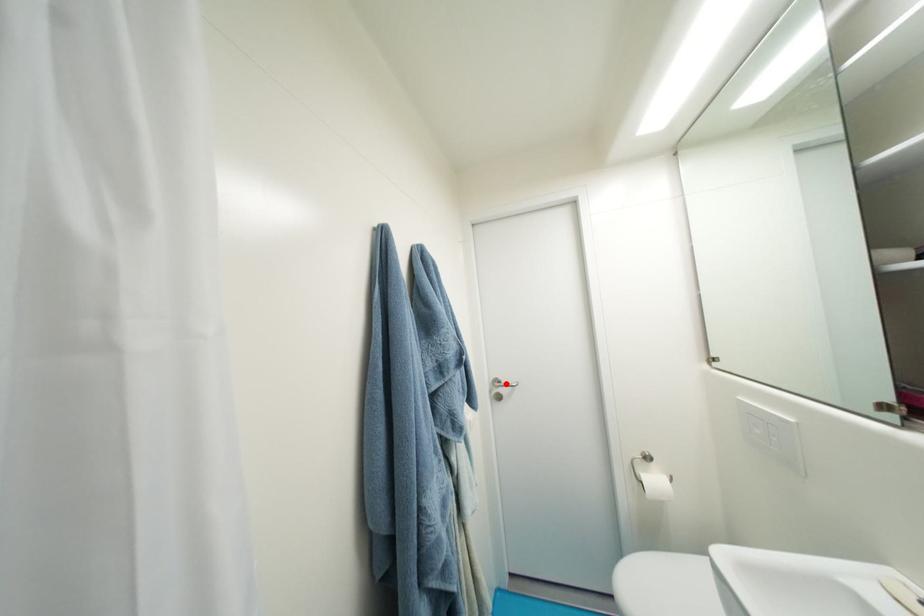
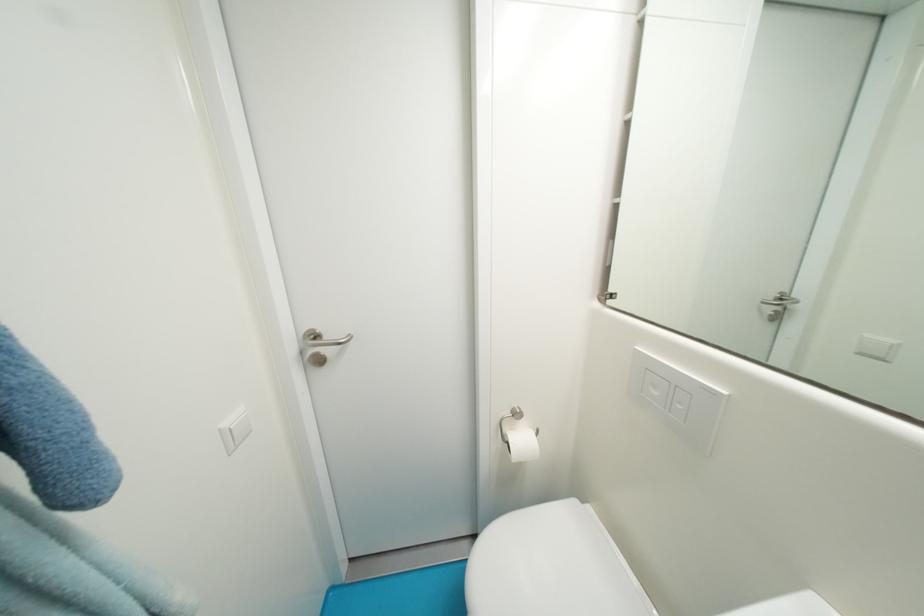
Locate, in the second image, the point that corresponds to the highlighted location in the first image.

(323, 339)